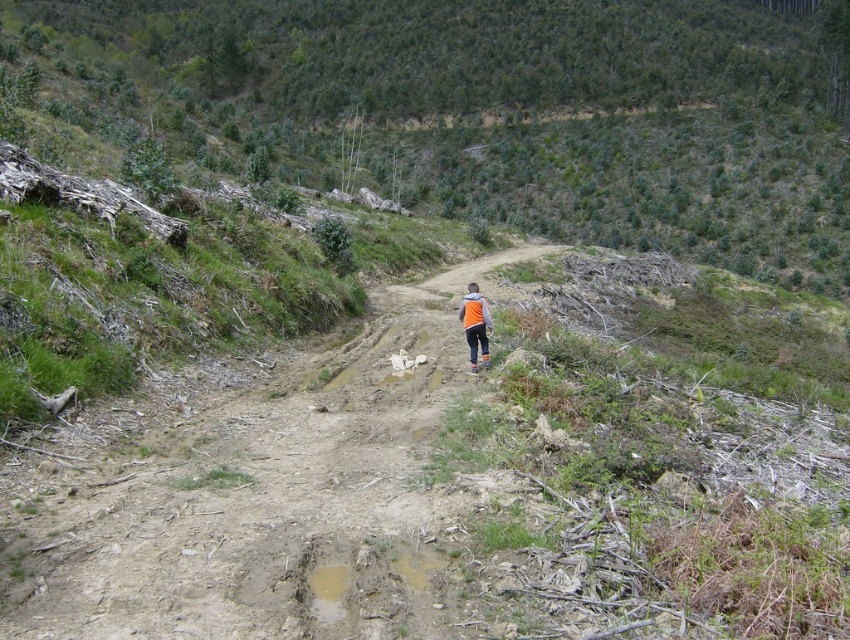
Who is positioned more to the left, dirt path at center or orange fleece jacket at center?

dirt path at center is more to the left.

Is dirt path at center to the right of orange fleece jacket at center from the viewer's perspective?

Incorrect, dirt path at center is not on the right side of orange fleece jacket at center.

Does point (244, 620) come in front of point (480, 332)?

Yes.

What are the coordinates of `dirt path at center` in the screenshot? It's located at (253, 496).